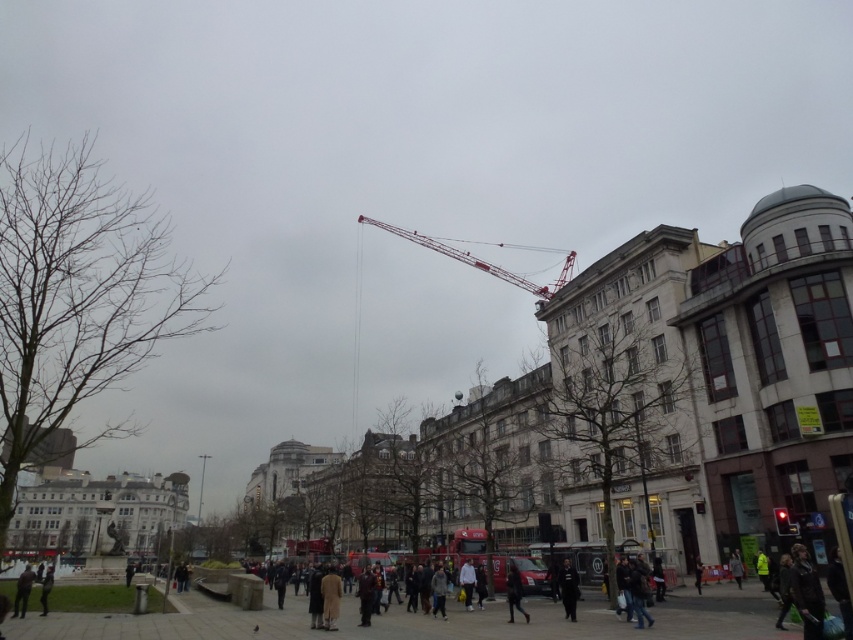
You are standing in the urban square and notice a metallic red crane at upper center. If you want to get a closer look at the crane, should you walk towards the crane or away from it?

The metallic red crane at upper center is 88.11 meters away from the viewer. To get closer to it, you should walk towards the crane.

You are standing in the urban square and want to walk from point A to point B. Point A is at coordinate point (525,284) and point B is at coordinate point (30,584). Considering the spatial relationship between these two points, which direction should you head to reach point B from point A?

To reach point B from point A, you should move towards the lower right direction since point B is located at a lower vertical position and further to the right horizontally compared to point A.